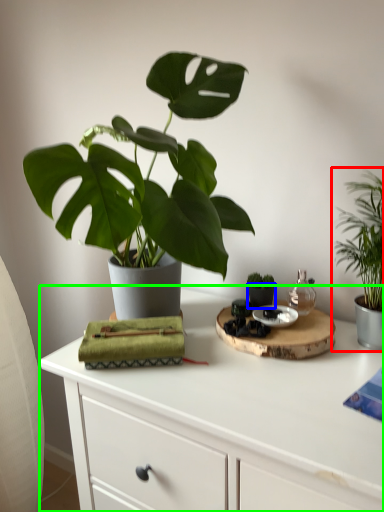
Question: Which is farther away from houseplant (highlighted by a red box)? flowerpot (highlighted by a blue box) or table (highlighted by a green box)?

Choices:
 (A) flowerpot
 (B) table

Answer: (B)